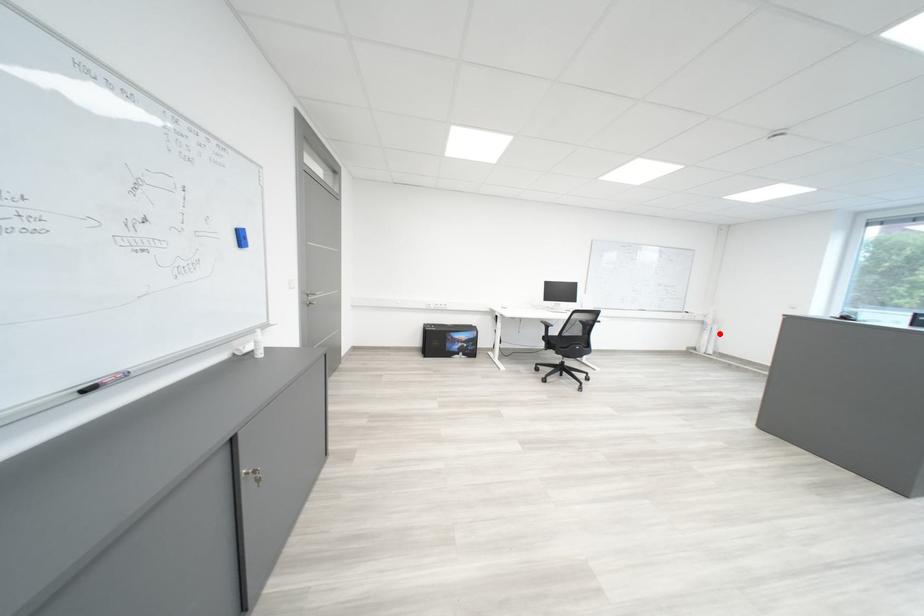
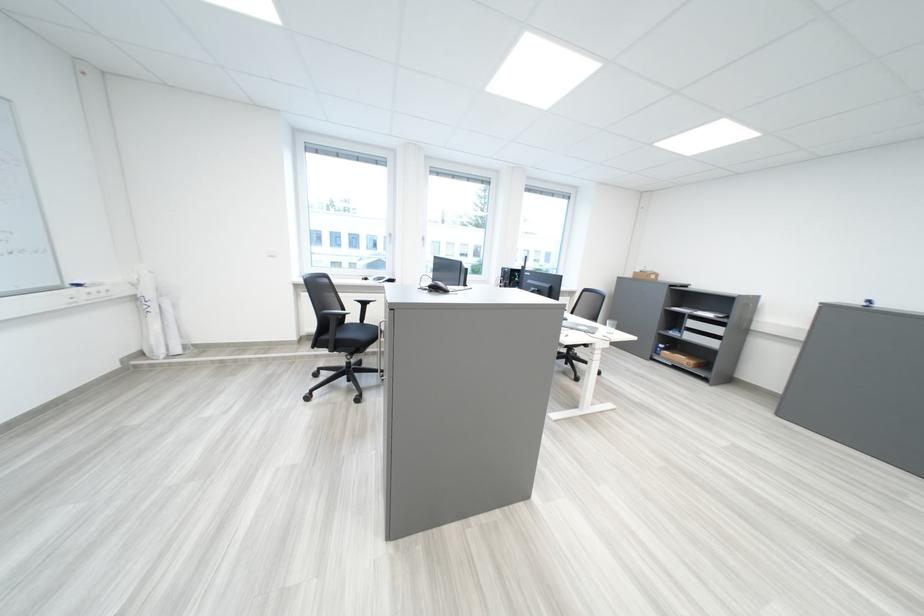
Question: I am providing you with two images of the same scene from different viewpoints. A red point is shown in image1. For the corresponding object point in image2, is it positioned nearer or farther from the camera?

Choices:
 (A) Nearer
 (B) Farther

Answer: (A)